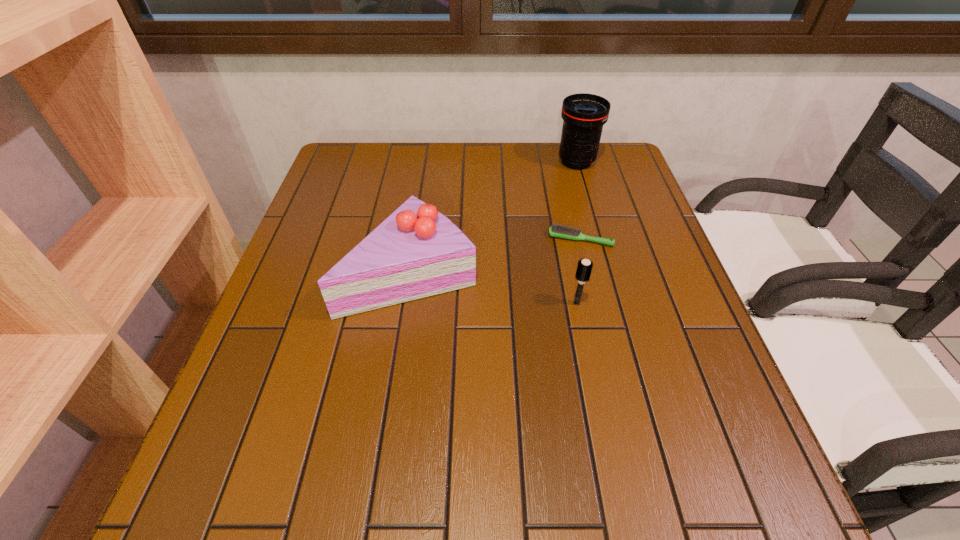
The width and height of the screenshot is (960, 540). I want to click on vacant space that satisfies the following two spatial constraints: 1. on the front side of the nearer hairbrush; 2. on the left side of the cake, so click(x=406, y=303).